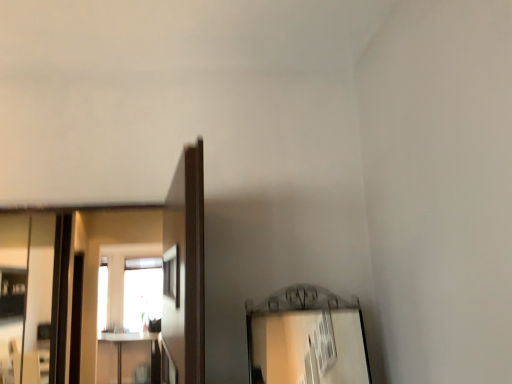
Question: In the image, is silver metallic mirror at left, which is the first mirror in front-to-back order, positioned in front of or behind clear glass mirror at left, acting as the second mirror starting from the right?

Choices:
 (A) front
 (B) behind

Answer: (A)

Question: From the image's perspective, is silver metallic mirror at left, which is the first mirror in front-to-back order, positioned above or below clear glass mirror at left, the 1th mirror positioned from the back?

Choices:
 (A) below
 (B) above

Answer: (B)

Question: Is silver metallic mirror at left, which is counted as the first mirror, starting from the right, bigger or smaller than clear glass mirror at left, acting as the second mirror starting from the right?

Choices:
 (A) big
 (B) small

Answer: (B)

Question: From the image's perspective, is clear glass mirror at left, which is the 2th mirror from front to back, located above or below silver metallic mirror at left, which is counted as the first mirror, starting from the right?

Choices:
 (A) below
 (B) above

Answer: (A)

Question: Considering the positions of clear glass mirror at left, the 1th mirror positioned from the back, and silver metallic mirror at left, which is counted as the 2th mirror, starting from the left, in the image, is clear glass mirror at left, the 1th mirror positioned from the back, taller or shorter than silver metallic mirror at left, which is counted as the 2th mirror, starting from the left,?

Choices:
 (A) short
 (B) tall

Answer: (B)

Question: Considering the relative positions of clear glass mirror at left, which is the 2th mirror from front to back, and silver metallic mirror at left, the second mirror from the back, in the image provided, is clear glass mirror at left, which is the 2th mirror from front to back, to the left or to the right of silver metallic mirror at left, the second mirror from the back,?

Choices:
 (A) left
 (B) right

Answer: (A)

Question: Is clear glass mirror at left, which is the 2th mirror from front to back, bigger or smaller than silver metallic mirror at left, which is counted as the first mirror, starting from the right?

Choices:
 (A) big
 (B) small

Answer: (A)